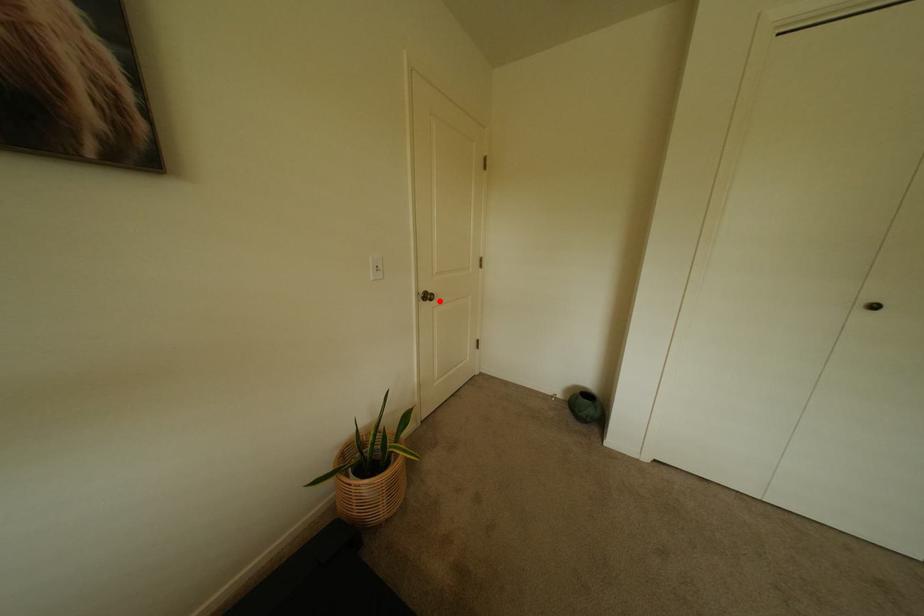
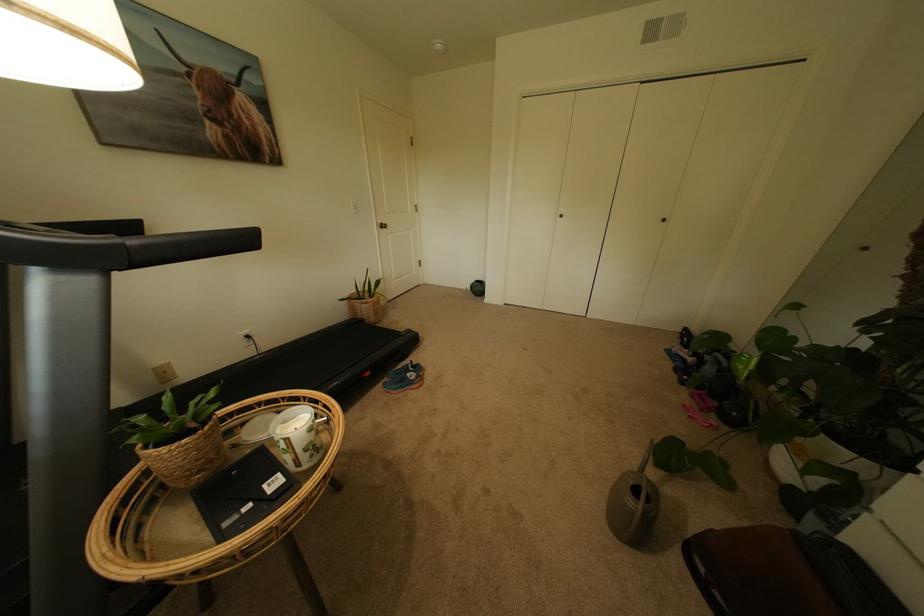
Where in the second image is the point corresponding to the highlighted location from the first image?

(394, 229)